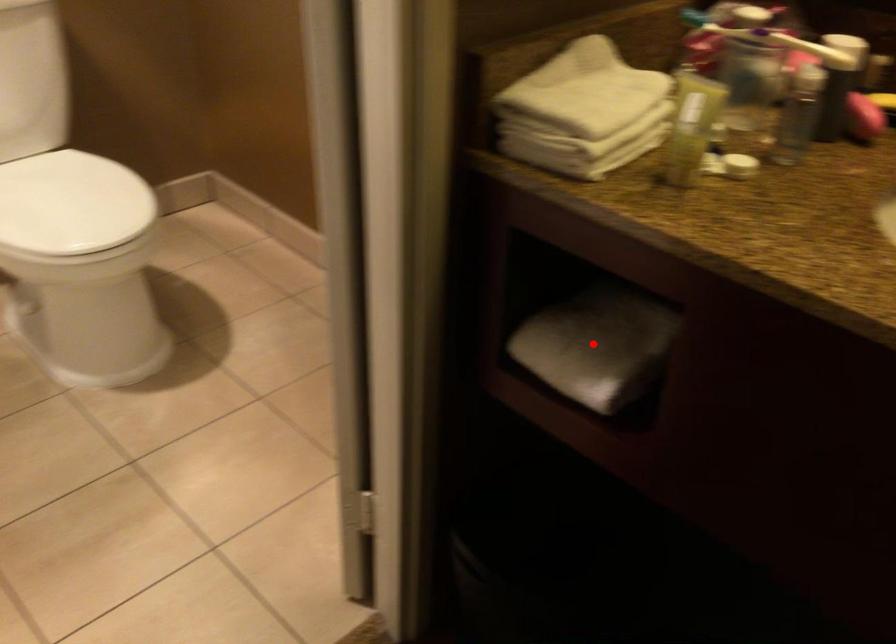
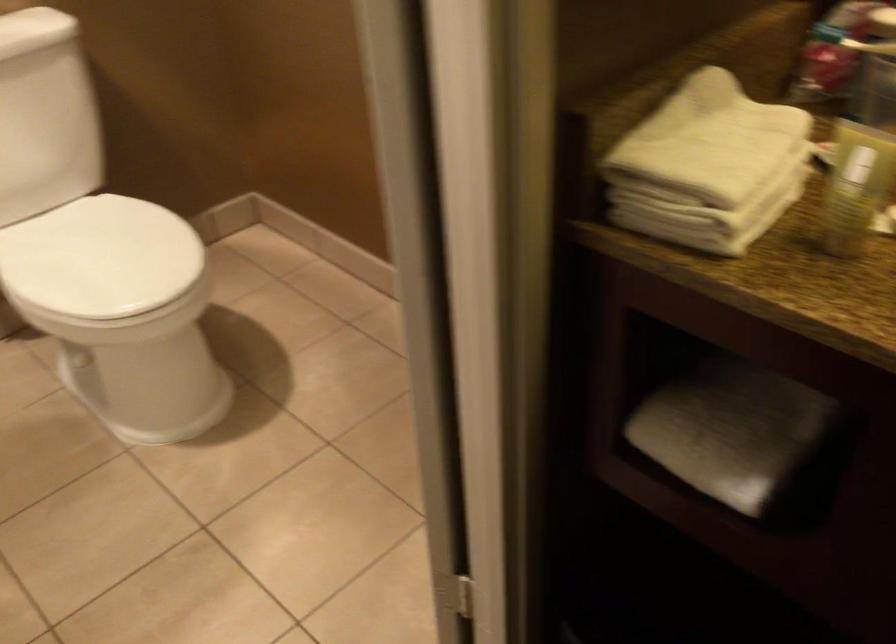
Find the pixel in the second image that matches the highlighted location in the first image.

(730, 431)